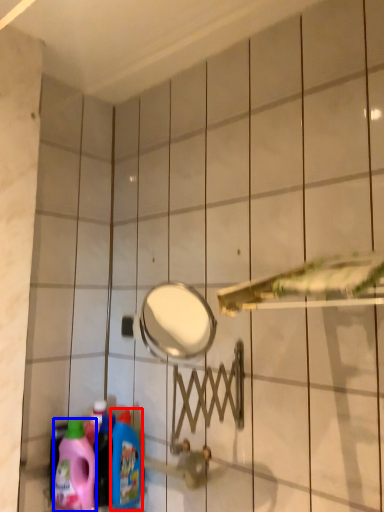
Question: Which of the following is the closest to the observer, cleaning product (highlighted by a red box) or cleaning product (highlighted by a blue box)?

Choices:
 (A) cleaning product
 (B) cleaning product

Answer: (B)